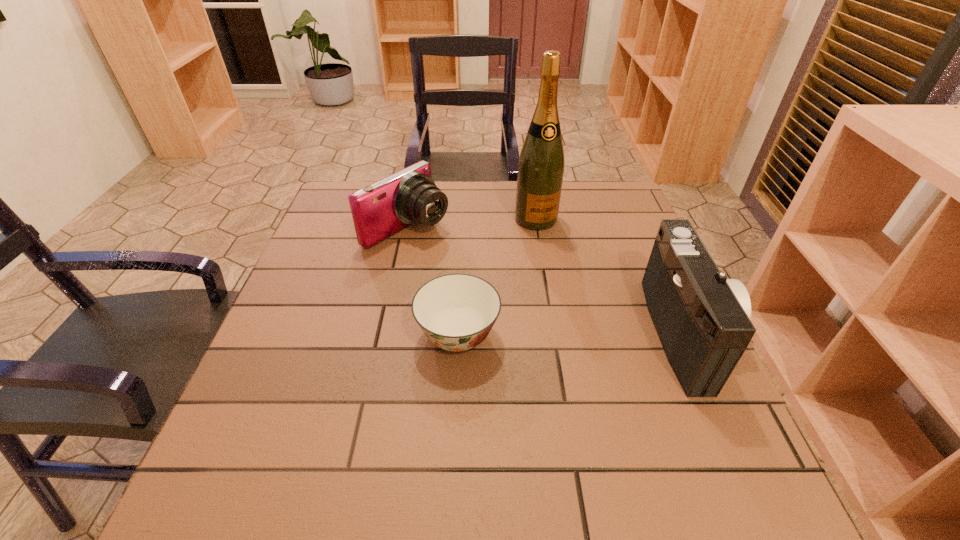
You are a GUI agent. You are given a task and a screenshot of the screen. Output one action in this format:
    pyautogui.click(x=<x>, y=<y>)
    Task: Click on the vacant space that is in between the second object from right to left and the soup bowl
    The height and width of the screenshot is (540, 960).
    Given the screenshot: What is the action you would take?
    pyautogui.click(x=497, y=278)

This screenshot has width=960, height=540. In order to click on unoccupied area between the soup bowl and the second tallest object in this screenshot , I will do `click(572, 334)`.

Find the location of a particular element. This screenshot has height=540, width=960. vacant point located between the tallest object and the second shortest object is located at coordinates (471, 224).

The image size is (960, 540). In order to click on blank region between the rightmost object and the camera in this screenshot , I will do click(x=547, y=281).

I want to click on vacant space in between the shortest object and the third shortest object, so click(572, 334).

Locate which object ranks second in proximity to the shortest object. Please provide its 2D coordinates. Your answer should be formatted as a tuple, i.e. [(x, y)], where the tuple contains the x and y coordinates of a point satisfying the conditions above.

[(541, 164)]

Find the location of `object that is the third closest one to the soup bowl`. object that is the third closest one to the soup bowl is located at coordinates (702, 319).

Identify the location of vacant region that satisfies the following two spatial constraints: 1. on the back side of the second object from right to left; 2. on the left side of the camera. (409, 219).

This screenshot has width=960, height=540. What are the coordinates of `free spot that satisfies the following two spatial constraints: 1. on the front side of the tallest object; 2. on the lens of the rightmost object` in the screenshot? It's located at [x=555, y=333].

This screenshot has width=960, height=540. I want to click on blank space that satisfies the following two spatial constraints: 1. on the front side of the camera; 2. on the lens of the camcorder, so pyautogui.click(x=386, y=333).